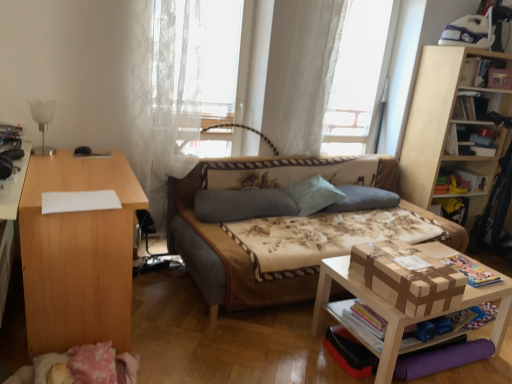
Question: Is white lace curtain at upper center, which ranks as the first curtain in right-to-left order, inside or outside of white wood table at lower right, positioned as the second table in left-to-right order?

Choices:
 (A) inside
 (B) outside

Answer: (B)

Question: From the image's perspective, relative to white wood table at lower right, which is the first table in right-to-left order, is white lace curtain at upper center, the 2th curtain positioned from the left, above or below?

Choices:
 (A) below
 (B) above

Answer: (B)

Question: Which object is positioned farthest from the light blue fabric pillow at center, which is the 2th pillow in right-to-left order?

Choices:
 (A) wooden toy box at right
 (B) wooden bookcase at upper right
 (C) floral fabric studio couch at center
 (D) hardcover book at upper right, the fourth book in the left-to-right sequence
 (E) white lace curtain at upper center, the 1th curtain in the left-to-right sequence

Answer: (D)

Question: Considering the real-world distances, which object is farthest from the wooden toy box at right?

Choices:
 (A) white glass lamp at left
 (B) hardcover book at upper right, acting as the third book starting from the left
 (C) hardcover book at upper right, positioned as the first book in right-to-left order
 (D) gray fabric pillow at center, which is counted as the 1th pillow, starting from the left
 (E) floral fabric studio couch at center

Answer: (A)